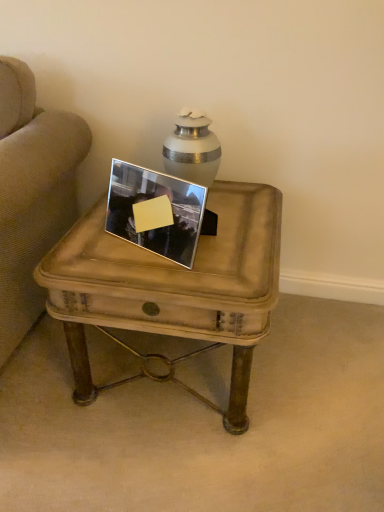
Question: Does silver metallic picture frame at center have a larger size compared to distressed wood coffee table at center?

Choices:
 (A) yes
 (B) no

Answer: (B)

Question: Is silver metallic picture frame at center positioned with its back to distressed wood coffee table at center?

Choices:
 (A) yes
 (B) no

Answer: (B)

Question: Is silver metallic picture frame at center at the left side of distressed wood coffee table at center?

Choices:
 (A) no
 (B) yes

Answer: (B)

Question: Is silver metallic picture frame at center to the right of distressed wood coffee table at center from the viewer's perspective?

Choices:
 (A) no
 (B) yes

Answer: (A)

Question: Does silver metallic picture frame at center lie in front of distressed wood coffee table at center?

Choices:
 (A) no
 (B) yes

Answer: (A)

Question: Is silver metallic picture frame at center further to the viewer compared to distressed wood coffee table at center?

Choices:
 (A) yes
 (B) no

Answer: (A)

Question: Does distressed wood coffee table at center appear on the left side of silver metallic picture frame at center?

Choices:
 (A) no
 (B) yes

Answer: (A)

Question: Is distressed wood coffee table at center in contact with silver metallic picture frame at center?

Choices:
 (A) yes
 (B) no

Answer: (B)

Question: Does distressed wood coffee table at center appear on the right side of silver metallic picture frame at center?

Choices:
 (A) no
 (B) yes

Answer: (B)

Question: Does distressed wood coffee table at center have a greater width compared to silver metallic picture frame at center?

Choices:
 (A) yes
 (B) no

Answer: (A)

Question: Is distressed wood coffee table at center looking in the opposite direction of silver metallic picture frame at center?

Choices:
 (A) no
 (B) yes

Answer: (A)

Question: From the image's perspective, does distressed wood coffee table at center appear higher than silver metallic picture frame at center?

Choices:
 (A) no
 (B) yes

Answer: (A)

Question: From the image's perspective, is distressed wood coffee table at center above or below silver metallic picture frame at center?

Choices:
 (A) below
 (B) above

Answer: (A)